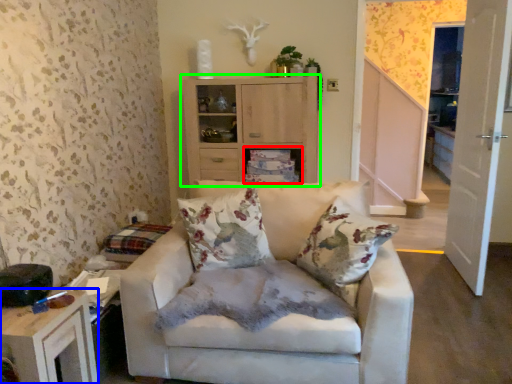
Question: Considering the real-world distances, which object is closest to shelf (highlighted by a red box)? table (highlighted by a blue box) or cabinetry (highlighted by a green box).

Choices:
 (A) table
 (B) cabinetry

Answer: (B)